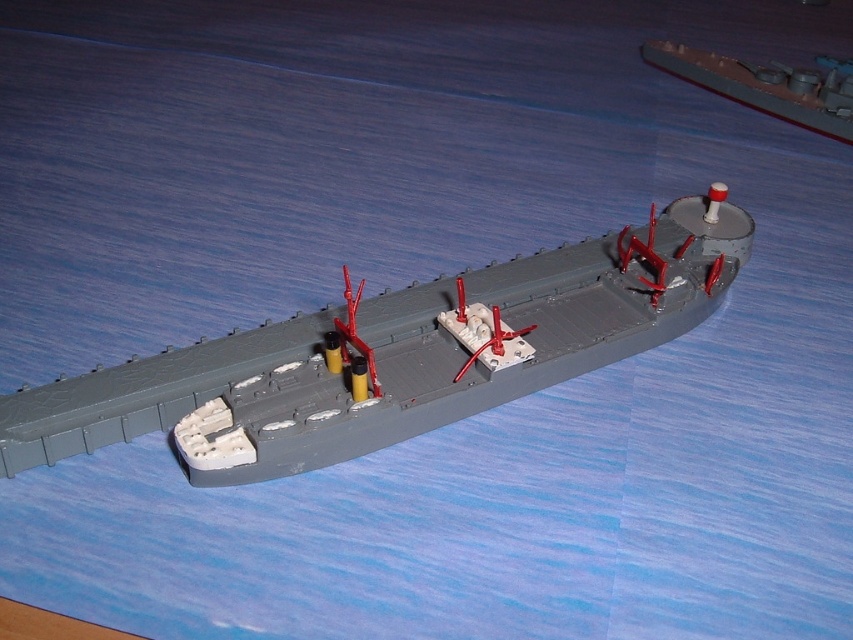
Question: Can you confirm if gray matte ship at center is positioned below gray matte ship at upper right?

Choices:
 (A) no
 (B) yes

Answer: (B)

Question: Is gray matte ship at center behind gray matte ship at upper right?

Choices:
 (A) yes
 (B) no

Answer: (B)

Question: Which object is farther from the camera taking this photo?

Choices:
 (A) gray matte ship at center
 (B) gray matte ship at upper right

Answer: (B)

Question: Among these points, which one is nearest to the camera?

Choices:
 (A) (836, 113)
 (B) (247, 435)

Answer: (B)

Question: Does gray matte ship at center appear under gray matte ship at upper right?

Choices:
 (A) no
 (B) yes

Answer: (B)